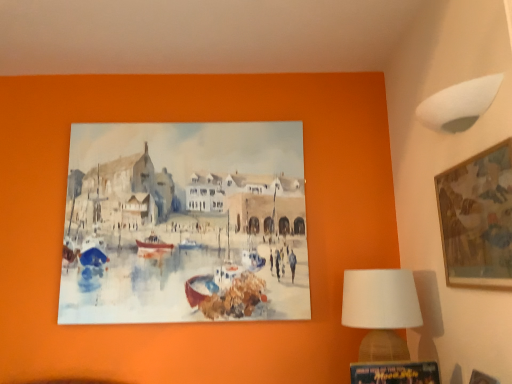
In order to click on wooden picture frame at lower right, the second picture frame when ordered from top to bottom in this screenshot , I will do `click(395, 372)`.

Measure the distance between white fabric lampshade at lower right and camera.

The distance of white fabric lampshade at lower right from camera is 5.10 feet.

Identify the location of wooden frame at upper right, the first picture frame viewed from the top. This screenshot has height=384, width=512. (477, 218).

Consider the image. Can you tell me how much white fabric lampshade at lower right and white fabric lampshade at upper right differ in facing direction?

The angle between the facing direction of white fabric lampshade at lower right and the facing direction of white fabric lampshade at upper right is 3.42 degrees.

Can you confirm if white fabric lampshade at lower right is wider than white fabric lampshade at upper right?

Indeed, white fabric lampshade at lower right has a greater width compared to white fabric lampshade at upper right.

In the scene shown: Is white fabric lampshade at lower right not inside white fabric lampshade at upper right?

white fabric lampshade at lower right lies outside white fabric lampshade at upper right's area.

Is point (371, 327) in front of point (465, 97)?

No.

Considering the relative sizes of wooden frame at upper right, the first picture frame viewed from the top, and wooden picture frame at lower right, which is the first picture frame from bottom to top, in the image provided, is wooden frame at upper right, the first picture frame viewed from the top, thinner than wooden picture frame at lower right, which is the first picture frame from bottom to top,?

Correct, the width of wooden frame at upper right, the first picture frame viewed from the top, is less than that of wooden picture frame at lower right, which is the first picture frame from bottom to top.

From the image's perspective, between wooden frame at upper right, acting as the 2th picture frame starting from the left, and wooden picture frame at lower right, the second picture frame when ordered from top to bottom, which one is located above?

wooden frame at upper right, acting as the 2th picture frame starting from the left.

Can you confirm if wooden frame at upper right, acting as the 2th picture frame starting from the left, is smaller than wooden picture frame at lower right, the second picture frame when ordered from top to bottom?

No.

Which point is more distant from viewer, (439, 187) or (411, 362)?

The point (439, 187) is more distant.

The width and height of the screenshot is (512, 384). I want to click on picture frame on the right of white fabric lampshade at lower right, so click(477, 218).

Which of these two, white fabric lampshade at lower right or wooden frame at upper right, arranged as the 1th picture frame when viewed from the right, is thinner?

With smaller width is wooden frame at upper right, arranged as the 1th picture frame when viewed from the right.

Looking at this image, which object is further away from the camera, white fabric lampshade at lower right or wooden frame at upper right, arranged as the 1th picture frame when viewed from the right?

white fabric lampshade at lower right is further from the camera.

How distant is white fabric lampshade at lower right from wooden frame at upper right, the second picture frame ordered from the bottom?

white fabric lampshade at lower right and wooden frame at upper right, the second picture frame ordered from the bottom, are 13.79 inches apart.

In the image, is white fabric lampshade at lower right positioned in front of or behind wooden picture frame at lower right, which is the first picture frame from bottom to top?

Visually, white fabric lampshade at lower right is located behind wooden picture frame at lower right, which is the first picture frame from bottom to top.

From a real-world perspective, is white fabric lampshade at lower right above or below wooden picture frame at lower right, which is the first picture frame from bottom to top?

From a real-world perspective, white fabric lampshade at lower right is physically above wooden picture frame at lower right, which is the first picture frame from bottom to top.

Are white fabric lampshade at lower right and wooden picture frame at lower right, the second picture frame when ordered from top to bottom, located far from each other?

No, there isn't a large distance between white fabric lampshade at lower right and wooden picture frame at lower right, the second picture frame when ordered from top to bottom.

From a real-world perspective, is white fabric lampshade at upper right on top of white fabric lampshade at lower right?

Yes, from a real-world perspective, white fabric lampshade at upper right is above white fabric lampshade at lower right.

Which of these two, white fabric lampshade at upper right or white fabric lampshade at lower right, stands shorter?

white fabric lampshade at upper right.

Is white fabric lampshade at upper right placed right next to white fabric lampshade at lower right?

white fabric lampshade at upper right and white fabric lampshade at lower right are clearly separated.

Based on the photo, does white fabric lampshade at upper right appear on the left side of white fabric lampshade at lower right?

In fact, white fabric lampshade at upper right is to the right of white fabric lampshade at lower right.

Is wooden picture frame at lower right, the 2th picture frame in the right-to-left sequence, not within white fabric lampshade at upper right?

wooden picture frame at lower right, the 2th picture frame in the right-to-left sequence, lies outside white fabric lampshade at upper right's area.

Is wooden picture frame at lower right, which is the first picture frame from bottom to top, to the left of white fabric lampshade at upper right from the viewer's perspective?

Yes.

Considering the relative sizes of wooden picture frame at lower right, the 2th picture frame in the right-to-left sequence, and white fabric lampshade at upper right in the image provided, is wooden picture frame at lower right, the 2th picture frame in the right-to-left sequence, wider than white fabric lampshade at upper right?

Indeed, wooden picture frame at lower right, the 2th picture frame in the right-to-left sequence, has a greater width compared to white fabric lampshade at upper right.

Who is bigger, wooden frame at upper right, the first picture frame viewed from the top, or white fabric lampshade at upper right?

wooden frame at upper right, the first picture frame viewed from the top.

Is wooden frame at upper right, the first picture frame viewed from the top, surrounding white fabric lampshade at upper right?

No, white fabric lampshade at upper right is located outside of wooden frame at upper right, the first picture frame viewed from the top.

From the image's perspective, which one is positioned higher, wooden frame at upper right, arranged as the 1th picture frame when viewed from the right, or white fabric lampshade at upper right?

white fabric lampshade at upper right appears higher in the image.

Is white fabric lampshade at upper right at the back of wooden frame at upper right, arranged as the 1th picture frame when viewed from the right?

wooden frame at upper right, arranged as the 1th picture frame when viewed from the right, does not have its back to white fabric lampshade at upper right.

I want to click on table lamp below the white fabric lampshade at upper right (from the image's perspective), so click(x=381, y=310).

The height and width of the screenshot is (384, 512). I want to click on picture frame in front of the wooden picture frame at lower right, which is the first picture frame from bottom to top, so click(x=477, y=218).

Based on their spatial positions, is white fabric lampshade at lower right or white fabric lampshade at upper right further from wooden frame at upper right, acting as the 2th picture frame starting from the left?

Based on the image, white fabric lampshade at lower right appears to be further to wooden frame at upper right, acting as the 2th picture frame starting from the left.

Estimate the real-world distances between objects in this image. Which object is further from wooden picture frame at lower right, marked as the 1th picture frame in a left-to-right arrangement, white fabric lampshade at lower right or white fabric lampshade at upper right?

Among the two, white fabric lampshade at upper right is located further to wooden picture frame at lower right, marked as the 1th picture frame in a left-to-right arrangement.

From the image, which object appears to be nearer to wooden frame at upper right, the first picture frame viewed from the top, white fabric lampshade at lower right or wooden picture frame at lower right, the second picture frame when ordered from top to bottom?

white fabric lampshade at lower right.

Looking at the image, which one is located closer to white fabric lampshade at lower right, white fabric lampshade at upper right or wooden frame at upper right, acting as the 2th picture frame starting from the left?

wooden frame at upper right, acting as the 2th picture frame starting from the left, is positioned closer to the anchor white fabric lampshade at lower right.

Considering their positions, is wooden picture frame at lower right, marked as the 1th picture frame in a left-to-right arrangement, positioned further to white fabric lampshade at lower right than wooden frame at upper right, the first picture frame viewed from the top?

wooden frame at upper right, the first picture frame viewed from the top, lies further to white fabric lampshade at lower right than the other object.

Estimate the real-world distances between objects in this image. Which object is further from wooden frame at upper right, acting as the 2th picture frame starting from the left, white fabric lampshade at upper right or white fabric lampshade at lower right?

white fabric lampshade at lower right is further to wooden frame at upper right, acting as the 2th picture frame starting from the left.

Considering their positions, is wooden frame at upper right, the first picture frame viewed from the top, positioned closer to white fabric lampshade at lower right than wooden picture frame at lower right, the second picture frame when ordered from top to bottom?

wooden picture frame at lower right, the second picture frame when ordered from top to bottom, is positioned closer to the anchor white fabric lampshade at lower right.

When comparing their distances from wooden picture frame at lower right, the 2th picture frame in the right-to-left sequence, does wooden frame at upper right, the second picture frame ordered from the bottom, or white fabric lampshade at lower right seem closer?

The object closer to wooden picture frame at lower right, the 2th picture frame in the right-to-left sequence, is white fabric lampshade at lower right.

Where is `table lamp between white fabric lampshade at upper right and wooden picture frame at lower right, which is the first picture frame from bottom to top, in the up-down direction`? Image resolution: width=512 pixels, height=384 pixels. table lamp between white fabric lampshade at upper right and wooden picture frame at lower right, which is the first picture frame from bottom to top, in the up-down direction is located at coordinates (381, 310).

The height and width of the screenshot is (384, 512). Find the location of `picture frame between white fabric lampshade at upper right and wooden picture frame at lower right, the second picture frame when ordered from top to bottom, vertically`. picture frame between white fabric lampshade at upper right and wooden picture frame at lower right, the second picture frame when ordered from top to bottom, vertically is located at coordinates (477, 218).

This screenshot has width=512, height=384. In order to click on table lamp between wooden frame at upper right, the second picture frame ordered from the bottom, and wooden picture frame at lower right, the second picture frame when ordered from top to bottom, in the vertical direction in this screenshot , I will do `click(381, 310)`.

Locate an element on the screen. picture frame between white fabric lampshade at upper right and white fabric lampshade at lower right from top to bottom is located at coordinates (477, 218).